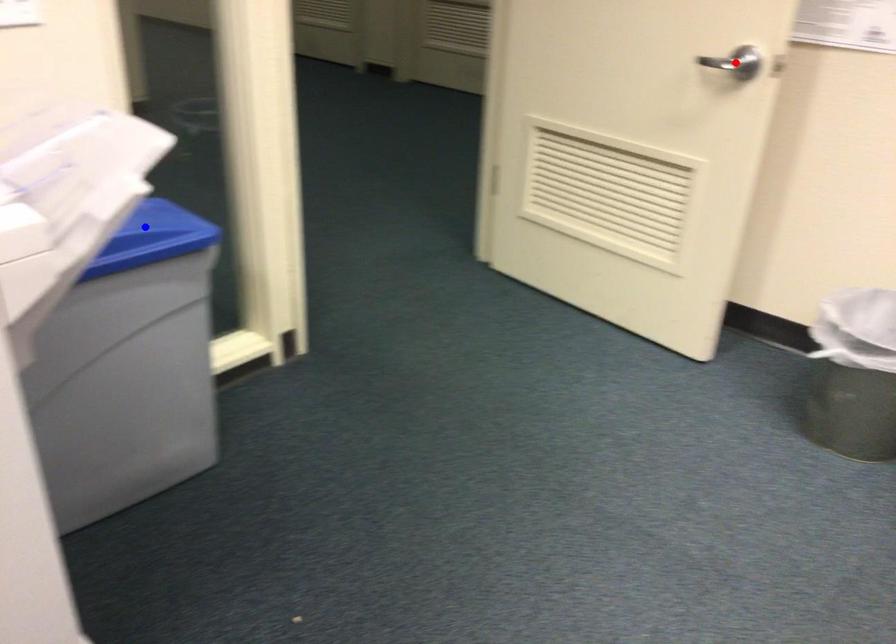
Question: Which of the two points in the image is closer to the camera?

Choices:
 (A) Blue point is closer.
 (B) Red point is closer.

Answer: (A)